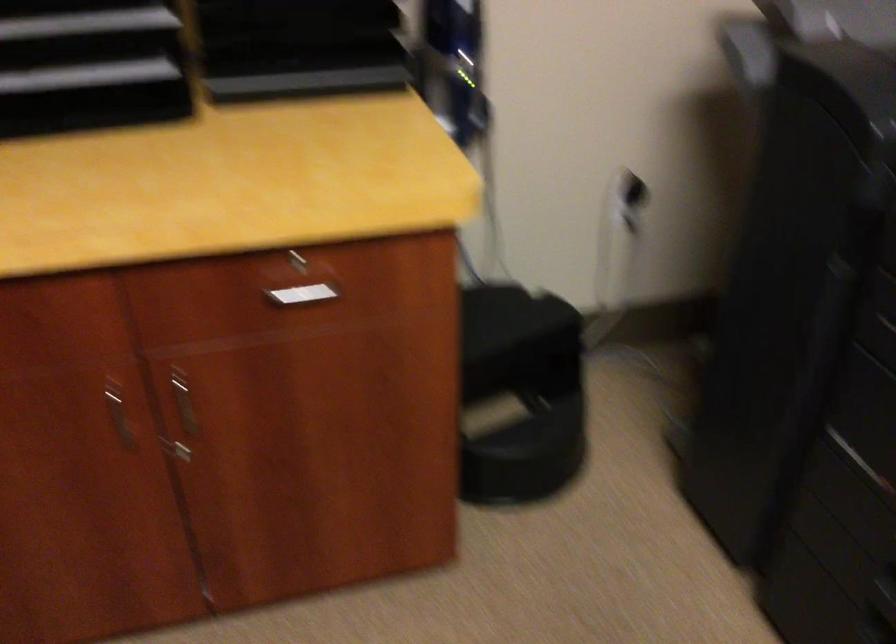
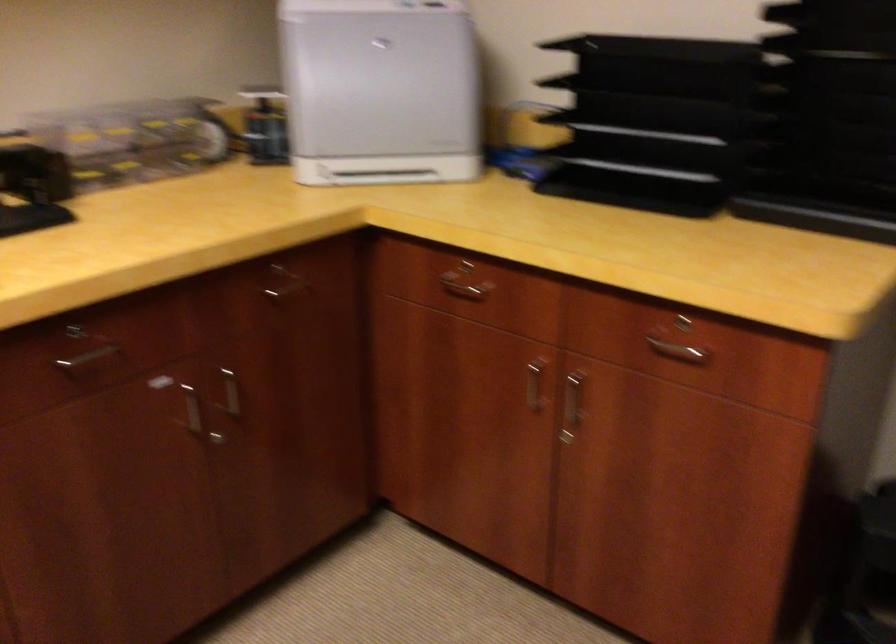
The point at (x=173, y=404) is marked in the first image. Where is the corresponding point in the second image?

(572, 401)